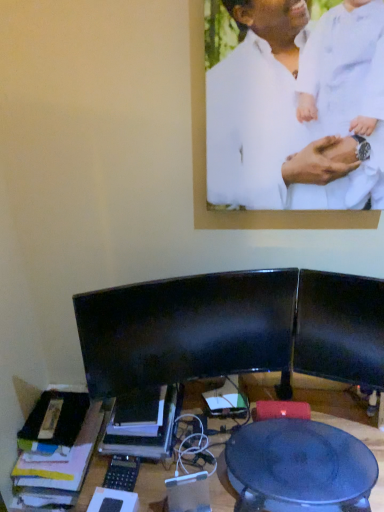
Question: Is black glossy monitor at center positioned with its back to matte black table at center?

Choices:
 (A) yes
 (B) no

Answer: (B)

Question: Can you confirm if black glossy monitor at center is positioned to the right of matte black table at center?

Choices:
 (A) no
 (B) yes

Answer: (A)

Question: Considering the relative sizes of black glossy monitor at center and matte black table at center in the image provided, is black glossy monitor at center bigger than matte black table at center?

Choices:
 (A) yes
 (B) no

Answer: (B)

Question: From the image's perspective, is black glossy monitor at center above matte black table at center?

Choices:
 (A) no
 (B) yes

Answer: (B)

Question: Would you say black glossy monitor at center contains matte black table at center?

Choices:
 (A) yes
 (B) no

Answer: (B)

Question: From their relative heights in the image, would you say matte black table at center is taller or shorter than white matte shirt at upper center?

Choices:
 (A) short
 (B) tall

Answer: (A)

Question: Looking at the image, does matte black table at center seem bigger or smaller compared to white matte shirt at upper center?

Choices:
 (A) small
 (B) big

Answer: (B)

Question: From a real-world perspective, relative to white matte shirt at upper center, is matte black table at center vertically above or below?

Choices:
 (A) below
 (B) above

Answer: (A)

Question: From the image's perspective, is matte black table at center above or below white matte shirt at upper center?

Choices:
 (A) above
 (B) below

Answer: (B)

Question: Based on their sizes in the image, would you say matte black table at center is bigger or smaller than black glossy monitor at center?

Choices:
 (A) big
 (B) small

Answer: (A)

Question: Does point (340, 500) appear closer or farther from the camera than point (130, 377)?

Choices:
 (A) closer
 (B) farther

Answer: (A)

Question: From a real-world perspective, relative to black glossy monitor at center, is matte black table at center vertically above or below?

Choices:
 (A) above
 (B) below

Answer: (B)

Question: In the image, is matte black table at center positioned in front of or behind black glossy monitor at center?

Choices:
 (A) front
 (B) behind

Answer: (A)

Question: In the image, is black glossy monitor at center positioned in front of or behind white matte shirt at upper center?

Choices:
 (A) behind
 (B) front

Answer: (A)

Question: Considering the relative positions of black glossy monitor at center and white matte shirt at upper center in the image provided, is black glossy monitor at center to the left or to the right of white matte shirt at upper center?

Choices:
 (A) right
 (B) left

Answer: (B)